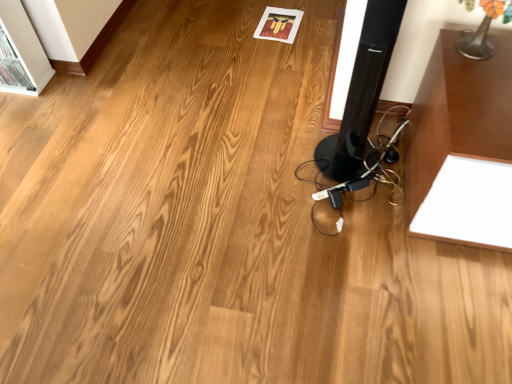
Locate an element on the screen. The image size is (512, 384). vacant space situated on the left part of black glossy speaker at center is located at coordinates (285, 158).